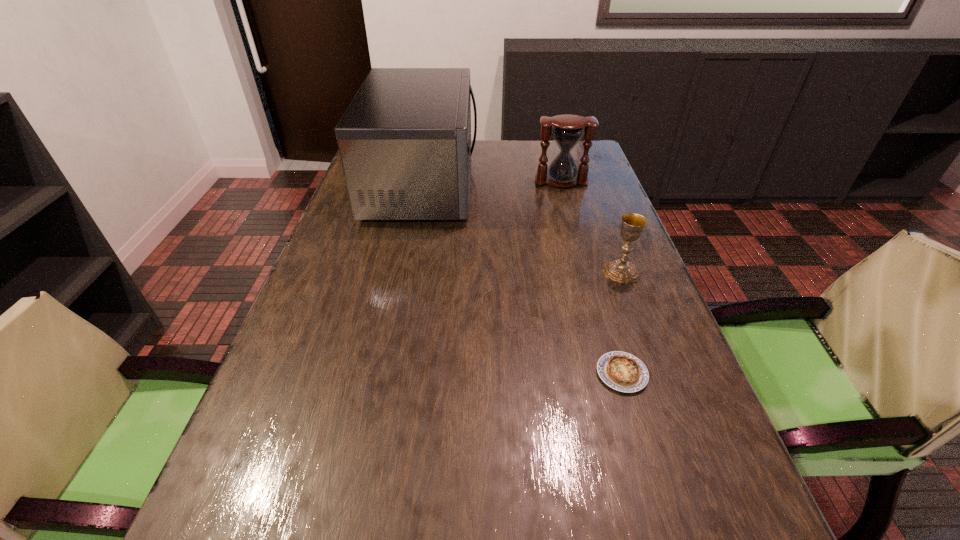
This screenshot has height=540, width=960. In order to click on blank region between the quiche and the leftmost object in this screenshot , I will do `click(522, 279)`.

At what (x,y) coordinates should I click in order to perform the action: click on vacant area that lies between the tallest object and the chalice. Please return your answer as a coordinate pair (x, y). The height and width of the screenshot is (540, 960). Looking at the image, I should click on (522, 228).

Find the location of `vacant point located between the quiche and the second shortest object`. vacant point located between the quiche and the second shortest object is located at coordinates (622, 323).

Locate an element on the screen. The height and width of the screenshot is (540, 960). free spot between the shortest object and the second tallest object is located at coordinates (591, 278).

Where is `unoccupied area between the third tallest object and the microwave oven`? The image size is (960, 540). unoccupied area between the third tallest object and the microwave oven is located at coordinates (522, 228).

This screenshot has height=540, width=960. Identify the location of object that is the second closest to the chalice. (x=405, y=139).

Identify which object is located as the second nearest to the nearest object. Please provide its 2D coordinates. Your answer should be formatted as a tuple, i.e. [(x, y)], where the tuple contains the x and y coordinates of a point satisfying the conditions above.

[(405, 139)]

The image size is (960, 540). In order to click on free space that satisfies the following two spatial constraints: 1. on the back side of the shortest object; 2. on the front-facing side of the leftmost object in this screenshot , I will do `click(565, 184)`.

The height and width of the screenshot is (540, 960). In order to click on vacant point that satisfies the following two spatial constraints: 1. on the front side of the third shortest object; 2. on the right side of the shortest object in this screenshot , I will do 615,374.

Image resolution: width=960 pixels, height=540 pixels. Identify the location of vacant space that satisfies the following two spatial constraints: 1. on the front-facing side of the leftmost object; 2. on the right side of the second nearest object. (405, 272).